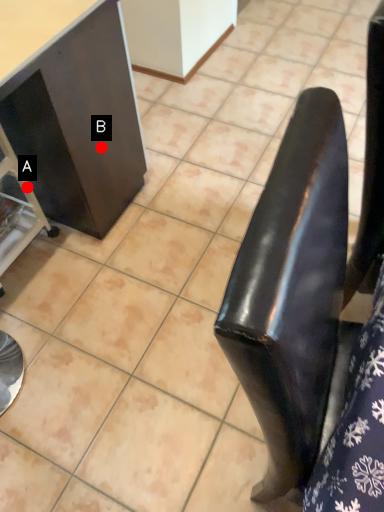
Question: Two points are circled on the image, labeled by A and B beside each circle. Which of the following is the farthest from the observer?

Choices:
 (A) A is further
 (B) B is further

Answer: (A)